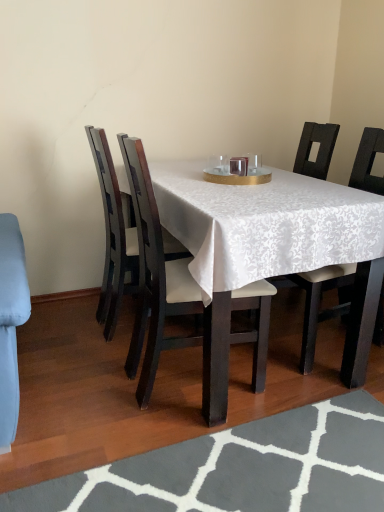
Identify the location of dark wood chair at left, which is counted as the 1th chair, starting from the left. This screenshot has height=512, width=384. (113, 237).

The image size is (384, 512). What do you see at coordinates (320, 302) in the screenshot?
I see `white fabric chair at center, acting as the 4th chair starting from the left` at bounding box center [320, 302].

The width and height of the screenshot is (384, 512). What do you see at coordinates (318, 149) in the screenshot?
I see `white fabric chair at center, placed as the 2th chair when sorted from right to left` at bounding box center [318, 149].

Where is `white fabric chair at center, placed as the 2th chair when sorted from right to left`? This screenshot has height=512, width=384. white fabric chair at center, placed as the 2th chair when sorted from right to left is located at coordinates click(318, 149).

This screenshot has height=512, width=384. What are the coordinates of `dark wood chair at left, the 4th chair when ordered from right to left` in the screenshot? It's located at (113, 237).

Can you confirm if gold textured tray at center is taller than dark wood chair at left, the 4th chair when ordered from right to left?

No, gold textured tray at center is not taller than dark wood chair at left, the 4th chair when ordered from right to left.

In the scene shown: Between gold textured tray at center and dark wood chair at left, the 4th chair when ordered from right to left, which one is positioned in front?

dark wood chair at left, the 4th chair when ordered from right to left.

Is point (248, 178) closer or farther from the camera than point (115, 252)?

Point (248, 178) is closer to the camera than point (115, 252).

Could you tell me if gold textured tray at center is facing dark wood chair at left, the 4th chair when ordered from right to left?

No.

Is dark wood chair at left, the 4th chair when ordered from right to left, thinner than white fabric chair at center, acting as the 3th chair starting from the left?

In fact, dark wood chair at left, the 4th chair when ordered from right to left, might be wider than white fabric chair at center, acting as the 3th chair starting from the left.

Starting from the dark wood chair at left, which is counted as the 1th chair, starting from the left, which chair is the 2nd one to the right? Please provide its 2D coordinates.

[(318, 149)]

Does point (97, 317) appear closer or farther from the camera than point (328, 168)?

Point (97, 317) appears to be closer to the viewer than point (328, 168).

Is white fabric chair at center, which ranks as the first chair in right-to-left order, with gray textured rug at lower center?

They are not placed beside each other.

Can you confirm if white fabric chair at center, which ranks as the first chair in right-to-left order, is thinner than gray textured rug at lower center?

Indeed, white fabric chair at center, which ranks as the first chair in right-to-left order, has a lesser width compared to gray textured rug at lower center.

Does point (334, 125) come farther from viewer compared to point (130, 486)?

Yes, it is behind point (130, 486).

Could you measure the distance between white fabric chair at center, which ranks as the first chair in right-to-left order, and gray textured rug at lower center?

white fabric chair at center, which ranks as the first chair in right-to-left order, is 23.70 inches away from gray textured rug at lower center.

Does white fabric-covered chair at center, which is counted as the second chair, starting from the left, have a greater height compared to white fabric chair at center, acting as the 3th chair starting from the left?

No, white fabric-covered chair at center, which is counted as the second chair, starting from the left, is not taller than white fabric chair at center, acting as the 3th chair starting from the left.

From a real-world perspective, is white fabric-covered chair at center, which is counted as the 3th chair, starting from the right, below white fabric chair at center, acting as the 3th chair starting from the left?

Yes.

Is white fabric-covered chair at center, which is counted as the 3th chair, starting from the right, bigger than white fabric chair at center, placed as the 2th chair when sorted from right to left?

Actually, white fabric-covered chair at center, which is counted as the 3th chair, starting from the right, might be smaller than white fabric chair at center, placed as the 2th chair when sorted from right to left.

How much distance is there between white fabric chair at center, placed as the 2th chair when sorted from right to left, and dark wood chair at left, which is counted as the 1th chair, starting from the left?

The distance of white fabric chair at center, placed as the 2th chair when sorted from right to left, from dark wood chair at left, which is counted as the 1th chair, starting from the left, is 3.37 feet.

Between white fabric chair at center, placed as the 2th chair when sorted from right to left, and dark wood chair at left, the 4th chair when ordered from right to left, which one has smaller size?

Smaller between the two is dark wood chair at left, the 4th chair when ordered from right to left.

Could you tell me if white fabric chair at center, placed as the 2th chair when sorted from right to left, is turned towards dark wood chair at left, the 4th chair when ordered from right to left?

Yes, white fabric chair at center, placed as the 2th chair when sorted from right to left, faces towards dark wood chair at left, the 4th chair when ordered from right to left.

From a real-world perspective, is white fabric chair at center, acting as the 3th chair starting from the left, positioned under dark wood chair at left, which is counted as the 1th chair, starting from the left, based on gravity?

No, from a real-world perspective, white fabric chair at center, acting as the 3th chair starting from the left, is not beneath dark wood chair at left, which is counted as the 1th chair, starting from the left.

Does white fabric chair at center, acting as the 3th chair starting from the left, have a larger size compared to gold textured tray at center?

Correct, white fabric chair at center, acting as the 3th chair starting from the left, is larger in size than gold textured tray at center.

From a real-world perspective, which is physically above, white fabric chair at center, placed as the 2th chair when sorted from right to left, or gold textured tray at center?

gold textured tray at center.

Would you say white fabric chair at center, acting as the 3th chair starting from the left, is to the left or to the right of gold textured tray at center in the picture?

Based on their positions, white fabric chair at center, acting as the 3th chair starting from the left, is located to the right of gold textured tray at center.

From the image's perspective, is white fabric chair at center, placed as the 2th chair when sorted from right to left, on gold textured tray at center?

No, from the image's perspective, white fabric chair at center, placed as the 2th chair when sorted from right to left, is not over gold textured tray at center.

Is white fabric chair at center, which ranks as the first chair in right-to-left order, far from white fabric chair at center, placed as the 2th chair when sorted from right to left?

Actually, white fabric chair at center, which ranks as the first chair in right-to-left order, and white fabric chair at center, placed as the 2th chair when sorted from right to left, are a little close together.

Consider the image. From a real-world perspective, who is located lower, white fabric chair at center, which ranks as the first chair in right-to-left order, or white fabric chair at center, acting as the 3th chair starting from the left?

In real-world perspective, white fabric chair at center, which ranks as the first chair in right-to-left order, is lower.

What's the angular difference between white fabric chair at center, acting as the 4th chair starting from the left, and white fabric chair at center, placed as the 2th chair when sorted from right to left,'s facing directions?

white fabric chair at center, acting as the 4th chair starting from the left, and white fabric chair at center, placed as the 2th chair when sorted from right to left, are facing 0.00121 degrees away from each other.

Would you say white fabric chair at center, acting as the 4th chair starting from the left, is to the left or to the right of white fabric chair at center, placed as the 2th chair when sorted from right to left, in the picture?

white fabric chair at center, acting as the 4th chair starting from the left, is to the right of white fabric chair at center, placed as the 2th chair when sorted from right to left.

You are a GUI agent. You are given a task and a screenshot of the screen. Output one action in this format:
    pyautogui.click(x=<x>, y=<y>)
    Task: Click on the tableware behind the dark wood chair at left, which is counted as the 1th chair, starting from the left
    Image resolution: width=384 pixels, height=512 pixels.
    Given the screenshot: What is the action you would take?
    pyautogui.click(x=237, y=170)

From a real-world perspective, starting from the white fabric chair at center, placed as the 2th chair when sorted from right to left, which chair is the 3rd one below it? Please provide its 2D coordinates.

[(113, 237)]

Considering their positions, is white fabric chair at center, acting as the 4th chair starting from the left, positioned further to dark wood chair at left, the 4th chair when ordered from right to left, than gray textured rug at lower center?

gray textured rug at lower center is further to dark wood chair at left, the 4th chair when ordered from right to left.

Based on their spatial positions, is white fabric chair at center, placed as the 2th chair when sorted from right to left, or gold textured tray at center closer to dark wood chair at left, the 4th chair when ordered from right to left?

Based on the image, gold textured tray at center appears to be nearer to dark wood chair at left, the 4th chair when ordered from right to left.

Which object lies further to the anchor point dark wood chair at left, the 4th chair when ordered from right to left, white fabric-covered chair at center, which is counted as the second chair, starting from the left, or gray textured rug at lower center?

Among the two, gray textured rug at lower center is located further to dark wood chair at left, the 4th chair when ordered from right to left.

From the image, which object appears to be farther from gray textured rug at lower center, gold textured tray at center or white fabric chair at center, acting as the 3th chair starting from the left?

white fabric chair at center, acting as the 3th chair starting from the left, lies further to gray textured rug at lower center than the other object.

From the image, which object appears to be farther from white fabric chair at center, acting as the 4th chair starting from the left, gold textured tray at center or white fabric-covered chair at center, which is counted as the 3th chair, starting from the right?

Based on the image, gold textured tray at center appears to be further to white fabric chair at center, acting as the 4th chair starting from the left.

Considering their positions, is white fabric-covered chair at center, which is counted as the second chair, starting from the left, positioned closer to dark wood chair at left, which is counted as the 1th chair, starting from the left, than white fabric chair at center, which ranks as the first chair in right-to-left order?

The object closer to dark wood chair at left, which is counted as the 1th chair, starting from the left, is white fabric-covered chair at center, which is counted as the second chair, starting from the left.

Estimate the real-world distances between objects in this image. Which object is further from dark wood chair at left, the 4th chair when ordered from right to left, white fabric-covered chair at center, which is counted as the 3th chair, starting from the right, or gold textured tray at center?

Among the two, gold textured tray at center is located further to dark wood chair at left, the 4th chair when ordered from right to left.

Which object lies further to the anchor point white fabric chair at center, which ranks as the first chair in right-to-left order, dark wood chair at left, the 4th chair when ordered from right to left, or white fabric chair at center, placed as the 2th chair when sorted from right to left?

Based on the image, dark wood chair at left, the 4th chair when ordered from right to left, appears to be further to white fabric chair at center, which ranks as the first chair in right-to-left order.

Locate an element on the screen. tableware situated between dark wood chair at left, the 4th chair when ordered from right to left, and white fabric chair at center, which ranks as the first chair in right-to-left order, from left to right is located at coordinates (237, 170).

Locate an element on the screen. tableware between white fabric-covered chair at center, which is counted as the second chair, starting from the left, and white fabric chair at center, which ranks as the first chair in right-to-left order is located at coordinates (237, 170).

Identify the location of tableware between white fabric chair at center, which ranks as the first chair in right-to-left order, and white fabric chair at center, placed as the 2th chair when sorted from right to left, from front to back. This screenshot has width=384, height=512. (237, 170).

Where is `chair situated between dark wood chair at left, the 4th chair when ordered from right to left, and white fabric chair at center, placed as the 2th chair when sorted from right to left, from left to right`? This screenshot has width=384, height=512. chair situated between dark wood chair at left, the 4th chair when ordered from right to left, and white fabric chair at center, placed as the 2th chair when sorted from right to left, from left to right is located at coordinates (157, 281).